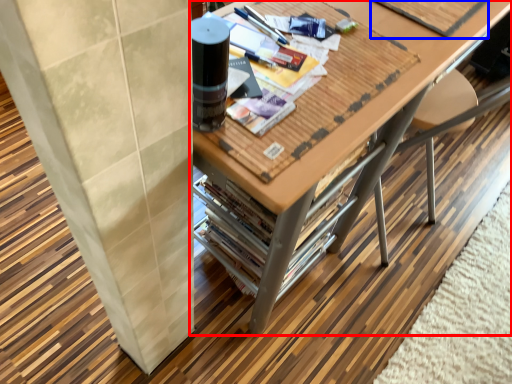
Question: Which object is closer to the camera taking this photo, table (highlighted by a red box) or magazine (highlighted by a blue box)?

Choices:
 (A) table
 (B) magazine

Answer: (A)